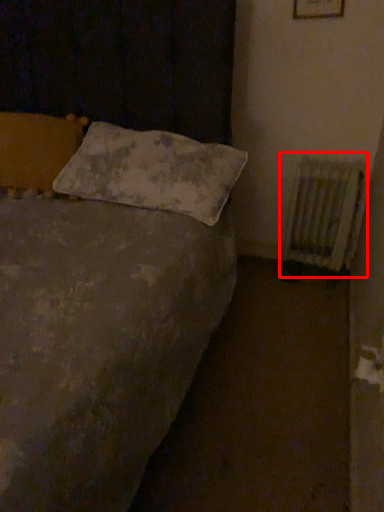
Question: From the image, what is the correct spatial relationship of radiator (annotated by the red box) in relation to pillow?

Choices:
 (A) left
 (B) right

Answer: (B)